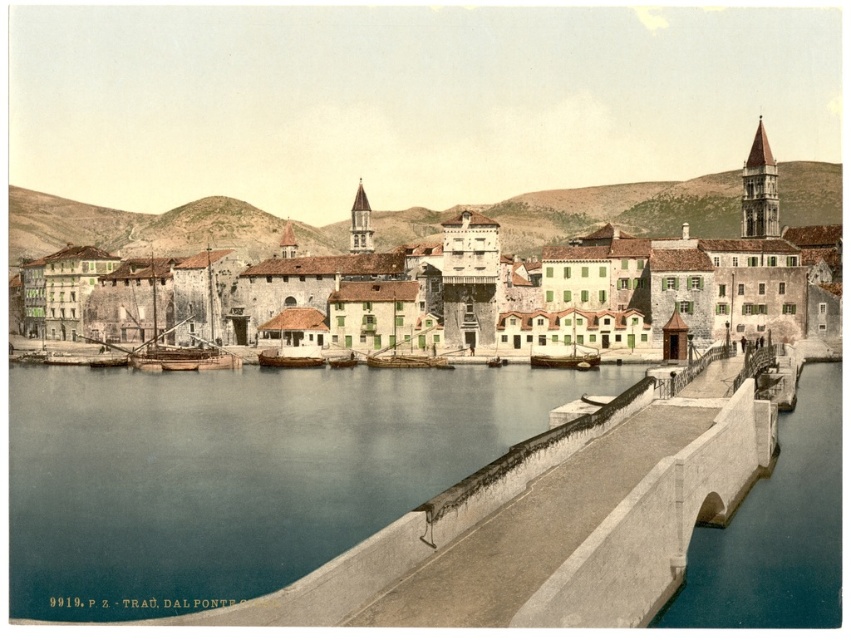
You are standing at the edge of the harbor in the coastal town and want to take a photo. There are two points marked in the scene, point 1 at coordinates point [358,432] and point 2 at coordinates point [178,244]. Which point will appear larger in your photo?

Point 1 at coordinates point [358,432] will appear larger in the photo because it is closer to the camera than point 2 at coordinates point [178,244].

You are standing on the waterfront looking out at the scene. Which object, the blue water at lower left or the stone buildings at center, appears closer to you in terms of vertical height?

The blue water at lower left appears shorter than the stone buildings at center, so the stone buildings at center are taller and thus appear closer in vertical height.

You are a tourist standing at the edge of the harbor looking towards the town. You notice the stone buildings at center and the wooden boat at center. Which object appears taller from your perspective?

The stone buildings at center appear taller than the wooden boat at center because the description states that the stone buildings at center is much taller as wooden boat at center.